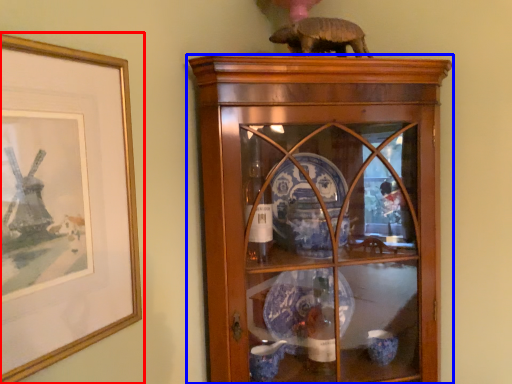
Question: Which of the following is the farthest to the observer, picture frame (highlighted by a red box) or shelf (highlighted by a blue box)?

Choices:
 (A) picture frame
 (B) shelf

Answer: (B)